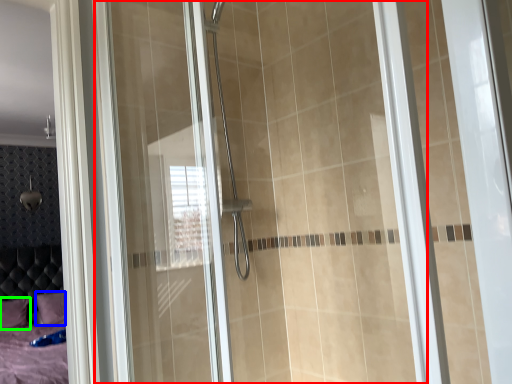
Question: Which object is the farthest from glass door (highlighted by a red box)? Choose among these: pillow (highlighted by a blue box) or pillow (highlighted by a green box).

Choices:
 (A) pillow
 (B) pillow

Answer: (B)